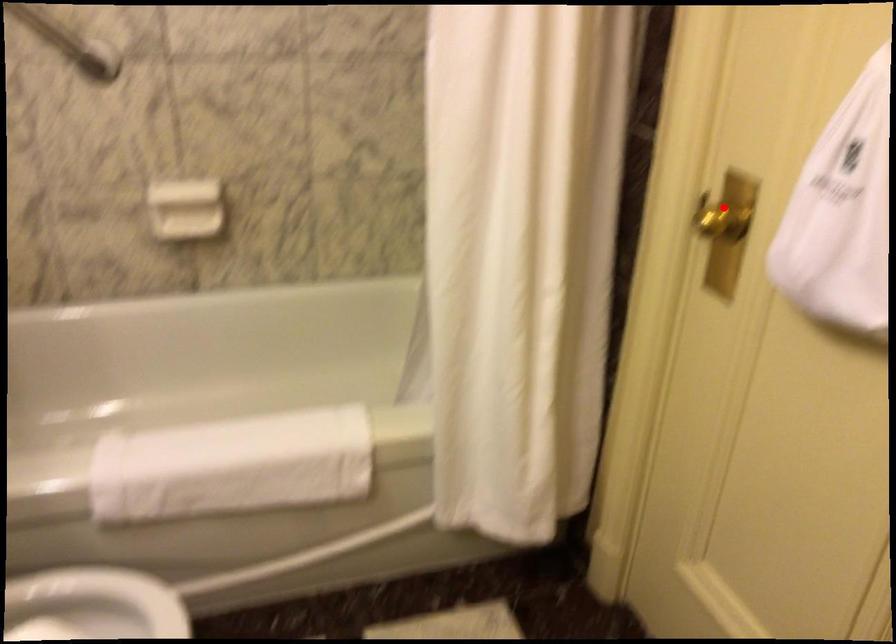
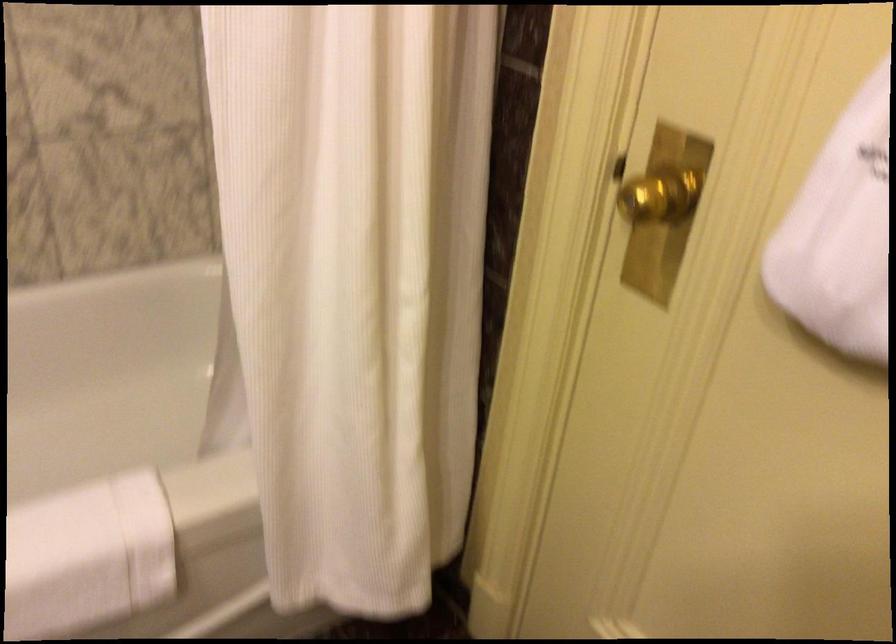
Question: I am providing you with two images of the same scene from different viewpoints. In image1, a red point is highlighted. Considering the same 3D point in image2, which of the following is correct?

Choices:
 (A) It is closer
 (B) It is farther

Answer: (A)